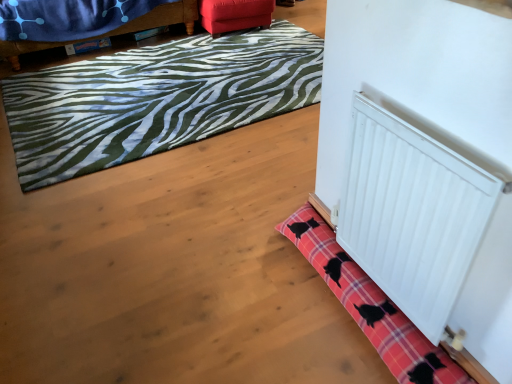
The width and height of the screenshot is (512, 384). Describe the element at coordinates (412, 214) in the screenshot. I see `white smooth radiator at lower right` at that location.

In order to face velvet red ottoman at upper center, the first furniture from the right, should I rotate leftwards or rightwards?

It's best to rotate left around 3.204 degrees.

In order to face velvet blue blanket at upper left, positioned as the 1th furniture in left-to-right order, should I rotate leftwards or rightwards?

Rotate your view left by about 19.928°.

In order to click on green zebra-patterned rug at upper left, the 1th bath mat in the back-to-front sequence in this screenshot , I will do `click(155, 99)`.

Locate an element on the screen. The width and height of the screenshot is (512, 384). white smooth radiator at lower right is located at coordinates (412, 214).

Is point (54, 101) closer to viewer compared to point (382, 254)?

No, (54, 101) is behind (382, 254).

Does green zebra-patterned rug at upper left, the 1th bath mat from the top, have a lesser width compared to white smooth radiator at lower right?

In fact, green zebra-patterned rug at upper left, the 1th bath mat from the top, might be wider than white smooth radiator at lower right.

Considering the sizes of objects green zebra-patterned rug at upper left, the 2th bath mat in the bottom-to-top sequence, and white smooth radiator at lower right in the image provided, who is smaller, green zebra-patterned rug at upper left, the 2th bath mat in the bottom-to-top sequence, or white smooth radiator at lower right?

With smaller size is white smooth radiator at lower right.

Based on their positions, is white smooth radiator at lower right located to the left or right of pink plaid bath mat at lower right, acting as the first bath mat starting from the bottom?

From the image, it's evident that white smooth radiator at lower right is to the right of pink plaid bath mat at lower right, acting as the first bath mat starting from the bottom.

Locate an element on the screen. the 1st bath mat to the left when counting from the white smooth radiator at lower right is located at coordinates (371, 306).

Which of these two, white smooth radiator at lower right or pink plaid bath mat at lower right, placed as the 1th bath mat when sorted from front to back, stands shorter?

pink plaid bath mat at lower right, placed as the 1th bath mat when sorted from front to back, is shorter.

From the image's perspective, which object appears higher, velvet red ottoman at upper center, the second furniture viewed from the left, or pink plaid bath mat at lower right, marked as the 2th bath mat in a top-to-bottom arrangement?

velvet red ottoman at upper center, the second furniture viewed from the left, appears higher in the image.

Between velvet red ottoman at upper center, the second furniture viewed from the left, and pink plaid bath mat at lower right, the 2th bath mat in the back-to-front sequence, which one has smaller size?

With smaller size is pink plaid bath mat at lower right, the 2th bath mat in the back-to-front sequence.

This screenshot has width=512, height=384. Identify the location of bath mat on the right of velvet red ottoman at upper center, the second furniture viewed from the left. (371, 306).

Is point (55, 46) closer to viewer compared to point (234, 16)?

Yes, point (55, 46) is in front of point (234, 16).

From the picture: From the image's perspective, does velvet blue blanket at upper left, positioned as the 1th furniture in left-to-right order, appear lower than velvet red ottoman at upper center, the second furniture viewed from the left?

Yes, from the image's perspective, velvet blue blanket at upper left, positioned as the 1th furniture in left-to-right order, is beneath velvet red ottoman at upper center, the second furniture viewed from the left.

Would you say velvet blue blanket at upper left, positioned as the 1th furniture in left-to-right order, is inside or outside velvet red ottoman at upper center, the first furniture from the right?

velvet blue blanket at upper left, positioned as the 1th furniture in left-to-right order, is outside velvet red ottoman at upper center, the first furniture from the right.

From a real-world perspective, between velvet blue blanket at upper left, positioned as the 1th furniture in left-to-right order, and velvet red ottoman at upper center, the second furniture viewed from the left, who is vertically lower?

velvet red ottoman at upper center, the second furniture viewed from the left, is physically lower.

Considering the sizes of white smooth radiator at lower right and velvet blue blanket at upper left, positioned as the 1th furniture in left-to-right order, in the image, is white smooth radiator at lower right wider or thinner than velvet blue blanket at upper left, positioned as the 1th furniture in left-to-right order,?

Clearly, white smooth radiator at lower right has less width compared to velvet blue blanket at upper left, positioned as the 1th furniture in left-to-right order.

In the scene shown: From a real-world perspective, relative to velvet blue blanket at upper left, which is the 2th furniture in right-to-left order, is white smooth radiator at lower right vertically above or below?

Clearly, from a real-world perspective, white smooth radiator at lower right is above velvet blue blanket at upper left, which is the 2th furniture in right-to-left order.

Which is more to the left, white smooth radiator at lower right or velvet blue blanket at upper left, positioned as the 1th furniture in left-to-right order?

From the viewer's perspective, velvet blue blanket at upper left, positioned as the 1th furniture in left-to-right order, appears more on the left side.

In the scene shown: Considering the relative sizes of white smooth radiator at lower right and velvet blue blanket at upper left, which is the 2th furniture in right-to-left order, in the image provided, is white smooth radiator at lower right taller than velvet blue blanket at upper left, which is the 2th furniture in right-to-left order,?

Yes.

From a real-world perspective, does white smooth radiator at lower right sit lower than velvet red ottoman at upper center, the first furniture from the right?

No, from a real-world perspective, white smooth radiator at lower right is not below velvet red ottoman at upper center, the first furniture from the right.

Is white smooth radiator at lower right bigger or smaller than velvet red ottoman at upper center, the first furniture from the right?

In the image, white smooth radiator at lower right appears to be smaller than velvet red ottoman at upper center, the first furniture from the right.

Based on their positions, is white smooth radiator at lower right located to the left or right of velvet red ottoman at upper center, the second furniture viewed from the left?

white smooth radiator at lower right is positioned on velvet red ottoman at upper center, the second furniture viewed from the left,'s right side.

Is white smooth radiator at lower right not inside velvet red ottoman at upper center, the first furniture from the right?

white smooth radiator at lower right lies outside velvet red ottoman at upper center, the first furniture from the right,'s area.

Is velvet blue blanket at upper left, which is the 2th furniture in right-to-left order, inside or outside of white smooth radiator at lower right?

The correct answer is: outside.

Is velvet blue blanket at upper left, which is the 2th furniture in right-to-left order, positioned with its back to white smooth radiator at lower right?

That's not correct — velvet blue blanket at upper left, which is the 2th furniture in right-to-left order, is not looking away from white smooth radiator at lower right.

Considering the sizes of velvet blue blanket at upper left, positioned as the 1th furniture in left-to-right order, and white smooth radiator at lower right in the image, is velvet blue blanket at upper left, positioned as the 1th furniture in left-to-right order, bigger or smaller than white smooth radiator at lower right?

velvet blue blanket at upper left, positioned as the 1th furniture in left-to-right order, is bigger than white smooth radiator at lower right.

From a real-world perspective, is velvet blue blanket at upper left, positioned as the 1th furniture in left-to-right order, above or below white smooth radiator at lower right?

velvet blue blanket at upper left, positioned as the 1th furniture in left-to-right order, is situated lower than white smooth radiator at lower right in the real world.

Identify the location of radiator lying in front of the green zebra-patterned rug at upper left, acting as the 2th bath mat starting from the front. The image size is (512, 384). [x=412, y=214].

At what (x,y) coordinates should I click in order to perform the action: click on radiator located above the pink plaid bath mat at lower right, placed as the 1th bath mat when sorted from front to back (from the image's perspective). Please return your answer as a coordinate pair (x, y). The width and height of the screenshot is (512, 384). Looking at the image, I should click on (412, 214).

Which object lies nearer to the anchor point white smooth radiator at lower right, pink plaid bath mat at lower right, acting as the first bath mat starting from the bottom, or velvet red ottoman at upper center, the second furniture viewed from the left?

pink plaid bath mat at lower right, acting as the first bath mat starting from the bottom, is positioned closer to the anchor white smooth radiator at lower right.

From the image, which object appears to be farther from velvet blue blanket at upper left, positioned as the 1th furniture in left-to-right order, green zebra-patterned rug at upper left, the 1th bath mat in the back-to-front sequence, or pink plaid bath mat at lower right, placed as the 1th bath mat when sorted from front to back?

pink plaid bath mat at lower right, placed as the 1th bath mat when sorted from front to back, is positioned further to the anchor velvet blue blanket at upper left, positioned as the 1th furniture in left-to-right order.

Estimate the real-world distances between objects in this image. Which object is further from pink plaid bath mat at lower right, marked as the 2th bath mat in a top-to-bottom arrangement, velvet red ottoman at upper center, the second furniture viewed from the left, or white smooth radiator at lower right?

velvet red ottoman at upper center, the second furniture viewed from the left, lies further to pink plaid bath mat at lower right, marked as the 2th bath mat in a top-to-bottom arrangement, than the other object.

When comparing their distances from velvet blue blanket at upper left, positioned as the 1th furniture in left-to-right order, does velvet red ottoman at upper center, the second furniture viewed from the left, or green zebra-patterned rug at upper left, acting as the 2th bath mat starting from the front, seem further?

Based on the image, green zebra-patterned rug at upper left, acting as the 2th bath mat starting from the front, appears to be further to velvet blue blanket at upper left, positioned as the 1th furniture in left-to-right order.

Estimate the real-world distances between objects in this image. Which object is closer to pink plaid bath mat at lower right, placed as the 1th bath mat when sorted from front to back, velvet red ottoman at upper center, the second furniture viewed from the left, or velvet blue blanket at upper left, positioned as the 1th furniture in left-to-right order?

The object closer to pink plaid bath mat at lower right, placed as the 1th bath mat when sorted from front to back, is velvet red ottoman at upper center, the second furniture viewed from the left.

From the image, which object appears to be nearer to green zebra-patterned rug at upper left, acting as the 2th bath mat starting from the front, pink plaid bath mat at lower right, acting as the first bath mat starting from the bottom, or velvet red ottoman at upper center, the second furniture viewed from the left?

velvet red ottoman at upper center, the second furniture viewed from the left.

Estimate the real-world distances between objects in this image. Which object is closer to velvet blue blanket at upper left, positioned as the 1th furniture in left-to-right order, pink plaid bath mat at lower right, acting as the first bath mat starting from the bottom, or green zebra-patterned rug at upper left, the 2th bath mat in the bottom-to-top sequence?

green zebra-patterned rug at upper left, the 2th bath mat in the bottom-to-top sequence, is closer to velvet blue blanket at upper left, positioned as the 1th furniture in left-to-right order.

From the image, which object appears to be nearer to white smooth radiator at lower right, velvet blue blanket at upper left, which is the 2th furniture in right-to-left order, or pink plaid bath mat at lower right, acting as the first bath mat starting from the bottom?

pink plaid bath mat at lower right, acting as the first bath mat starting from the bottom, is closer to white smooth radiator at lower right.

You are a GUI agent. You are given a task and a screenshot of the screen. Output one action in this format:
    pyautogui.click(x=<x>, y=<y>)
    Task: Click on the bath mat between pink plaid bath mat at lower right, placed as the 1th bath mat when sorted from front to back, and velvet red ottoman at upper center, the first furniture from the right, in the front-back direction
    Image resolution: width=512 pixels, height=384 pixels.
    Given the screenshot: What is the action you would take?
    pyautogui.click(x=155, y=99)

The height and width of the screenshot is (384, 512). What are the coordinates of `bath mat between white smooth radiator at lower right and green zebra-patterned rug at upper left, the 1th bath mat from the top, from front to back` in the screenshot? It's located at (371, 306).

This screenshot has height=384, width=512. In order to click on radiator between velvet blue blanket at upper left, positioned as the 1th furniture in left-to-right order, and pink plaid bath mat at lower right, the 2th bath mat in the back-to-front sequence, in the vertical direction in this screenshot , I will do `click(412, 214)`.

At what (x,y) coordinates should I click in order to perform the action: click on furniture between pink plaid bath mat at lower right, marked as the 2th bath mat in a top-to-bottom arrangement, and velvet red ottoman at upper center, the first furniture from the right, along the z-axis. Please return your answer as a coordinate pair (x, y). Looking at the image, I should click on (113, 30).